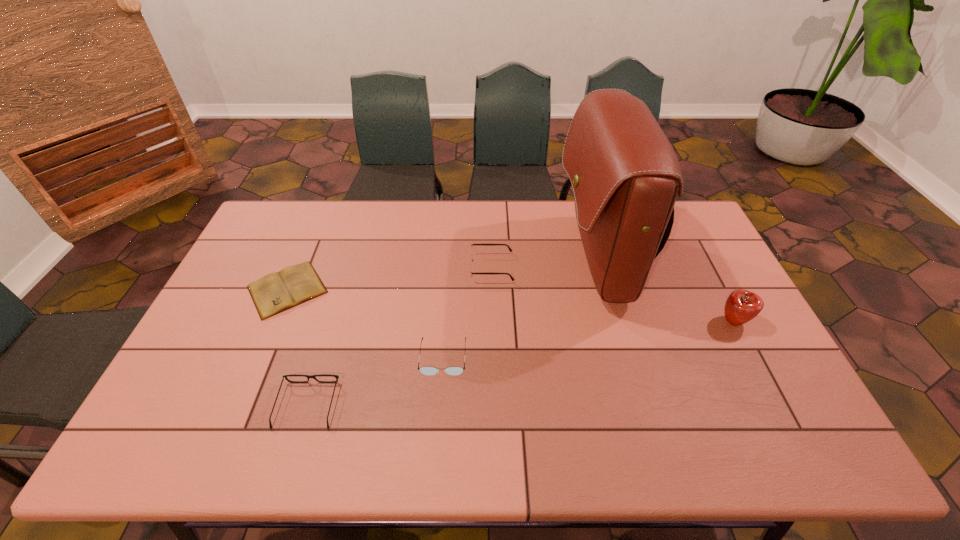
This screenshot has height=540, width=960. What are the coordinates of `free spot that satisfies the following two spatial constraints: 1. on the open flap of the second object from right to left; 2. on the lenses of the second farthest spectacles` in the screenshot? It's located at (624, 357).

Find the location of a particular element. free space that satisfies the following two spatial constraints: 1. on the back side of the fifth shortest object; 2. on the open flap of the fifth object from left to right is located at coordinates (701, 260).

You are a GUI agent. You are given a task and a screenshot of the screen. Output one action in this format:
    pyautogui.click(x=<x>, y=<y>)
    Task: Click on the free space that satisfies the following two spatial constraints: 1. at the hinge ends of the rightmost object; 2. on the left side of the farthest spectacles
    
    Given the screenshot: What is the action you would take?
    pyautogui.click(x=492, y=321)